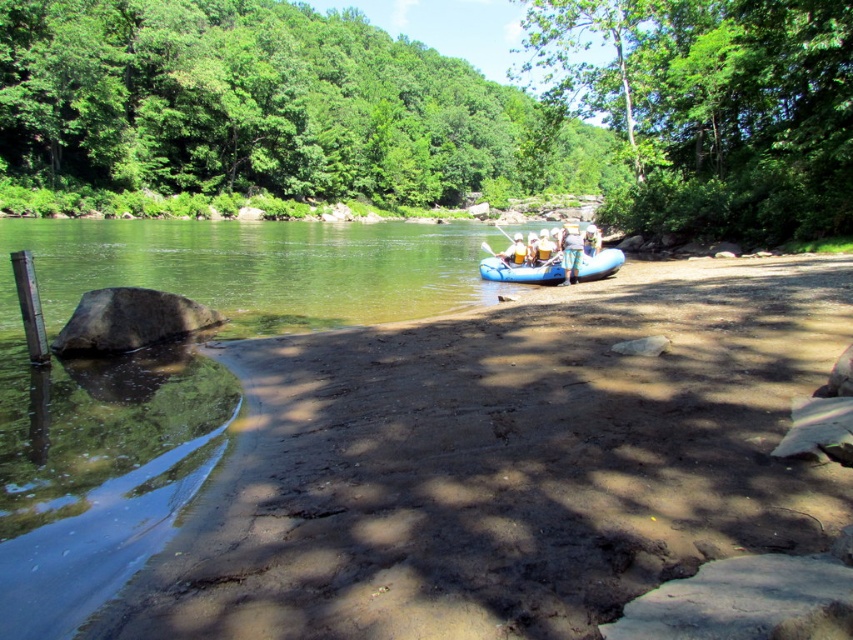
Question: From the image, what is the correct spatial relationship of white fabric raft at center in relation to yellow fabric shirt at center?

Choices:
 (A) left
 (B) right

Answer: (A)

Question: Estimate the real-world distances between objects in this image. Which object is farther from the white fabric raft at center?

Choices:
 (A) brown dirt shore at lower left
 (B) blue rubber raft at center

Answer: (A)

Question: Which object is farther from the camera taking this photo?

Choices:
 (A) brown dirt shore at lower left
 (B) white plastic paddle at center
 (C) blue fabric raft at center
 (D) blue rubber raft at center

Answer: (B)

Question: Is white fabric raft at center thinner than white plastic paddle at center?

Choices:
 (A) no
 (B) yes

Answer: (A)

Question: Does blue fabric raft at center appear on the left side of white fabric raft at center?

Choices:
 (A) yes
 (B) no

Answer: (B)

Question: Which object appears closest to the camera in this image?

Choices:
 (A) blue fabric raft at center
 (B) yellow fabric shirt at center
 (C) white fabric raft at center
 (D) brown dirt shore at lower left

Answer: (D)